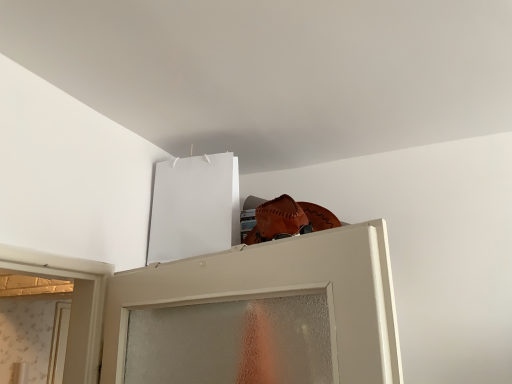
What is the approximate width of white paper bag at upper center?

10.10 centimeters.

Describe the element at coordinates (194, 207) in the screenshot. I see `white paper bag at upper center` at that location.

Image resolution: width=512 pixels, height=384 pixels. Find the location of `white paper bag at upper center`. white paper bag at upper center is located at coordinates (194, 207).

Where is `white paper bag at upper center`? white paper bag at upper center is located at coordinates (194, 207).